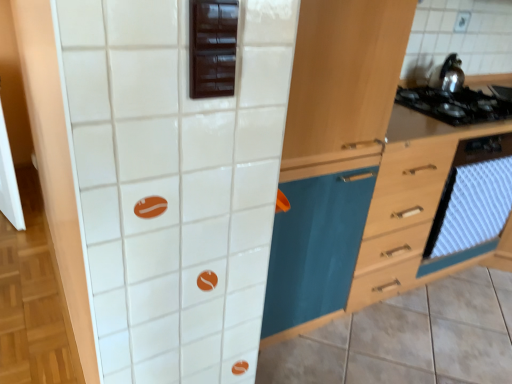
Locate an element on the screen. Image resolution: width=512 pixels, height=384 pixels. vacant space to the right of wooden cabinet at center is located at coordinates (387, 348).